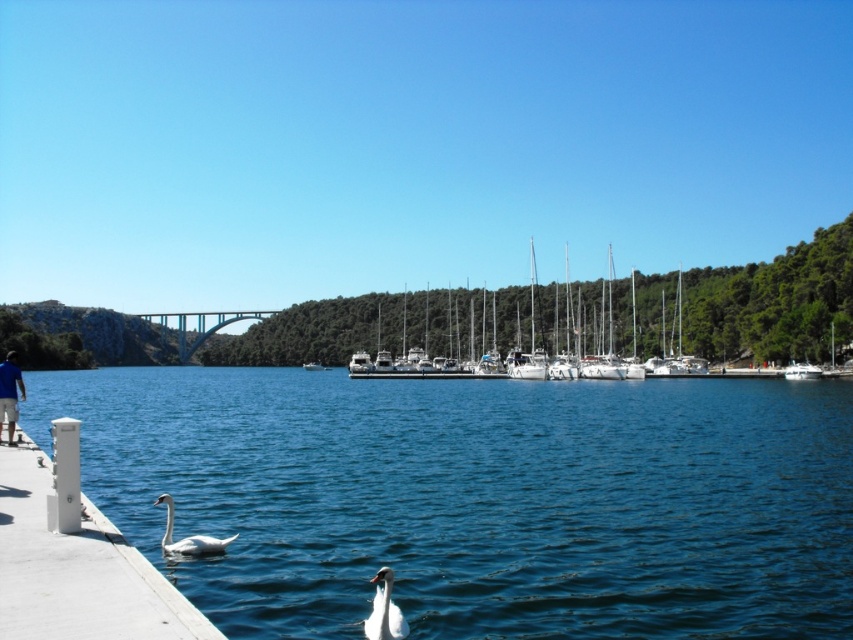
Question: Can you confirm if white glossy swan at lower left is bigger than white matte sailboat at center?

Choices:
 (A) yes
 (B) no

Answer: (B)

Question: Which point is farther from the camera taking this photo?

Choices:
 (A) (804, 372)
 (B) (4, 372)

Answer: (A)

Question: Observing the image, what is the correct spatial positioning of white glossy swan at lower center in reference to white glossy swan at lower left?

Choices:
 (A) right
 (B) left

Answer: (A)

Question: Considering the real-world distances, which object is closest to the white matte sailboat at center?

Choices:
 (A) white concrete dock at lower left
 (B) white matte boats at center
 (C) white glossy swan at lower left
 (D) blue fabric shirt at lower left

Answer: (B)

Question: Is blue fabric shirt at lower left in front of white matte sailboat at center?

Choices:
 (A) no
 (B) yes

Answer: (B)

Question: Which object is farther from the camera taking this photo?

Choices:
 (A) white glossy swan at lower center
 (B) blue fabric shirt at lower left
 (C) white concrete dock at lower left

Answer: (B)